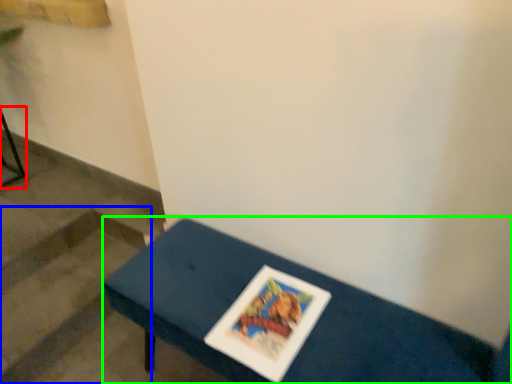
Question: Estimate the real-world distances between objects in this image. Which object is farther from furniture (highlighted by a red box), stairwell (highlighted by a blue box) or table (highlighted by a green box)?

Choices:
 (A) stairwell
 (B) table

Answer: (B)